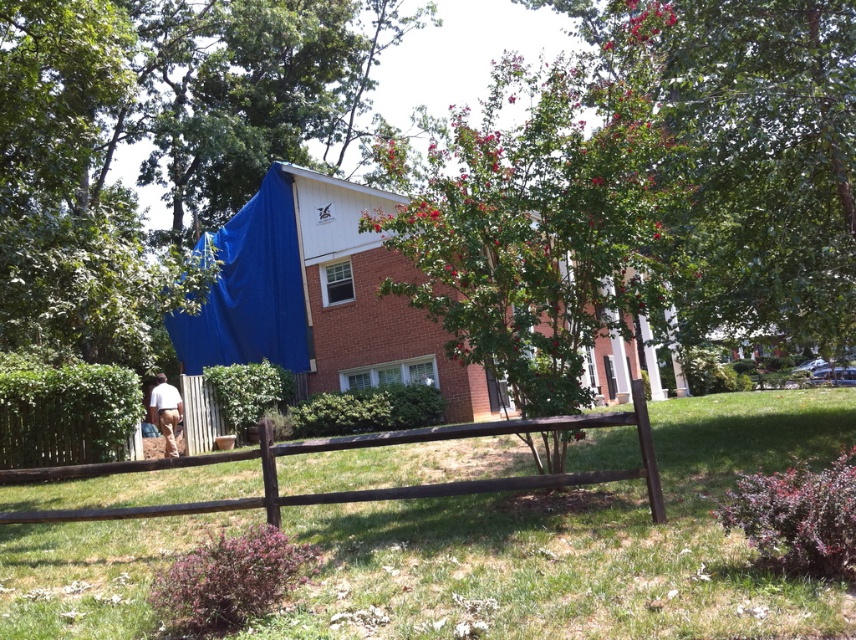
Question: Based on their relative distances, which object is nearer to the brown wooden fence at center?

Choices:
 (A) green leafy tree at center
 (B) brown wooden fence at lower left

Answer: (B)

Question: Can you confirm if brown wooden fence at center is positioned above white matte shorts at lower left?

Choices:
 (A) no
 (B) yes

Answer: (B)

Question: Does brown wooden fence at lower left have a greater width compared to green leafy tree at center?

Choices:
 (A) yes
 (B) no

Answer: (A)

Question: Which point is farther to the camera?

Choices:
 (A) white matte shorts at lower left
 (B) brown wooden fence at center

Answer: (A)

Question: Is brown wooden fence at center below white matte shorts at lower left?

Choices:
 (A) yes
 (B) no

Answer: (B)

Question: Estimate the real-world distances between objects in this image. Which object is closer to the brown wooden fence at center?

Choices:
 (A) green leafy tree at center
 (B) white matte shorts at lower left

Answer: (B)